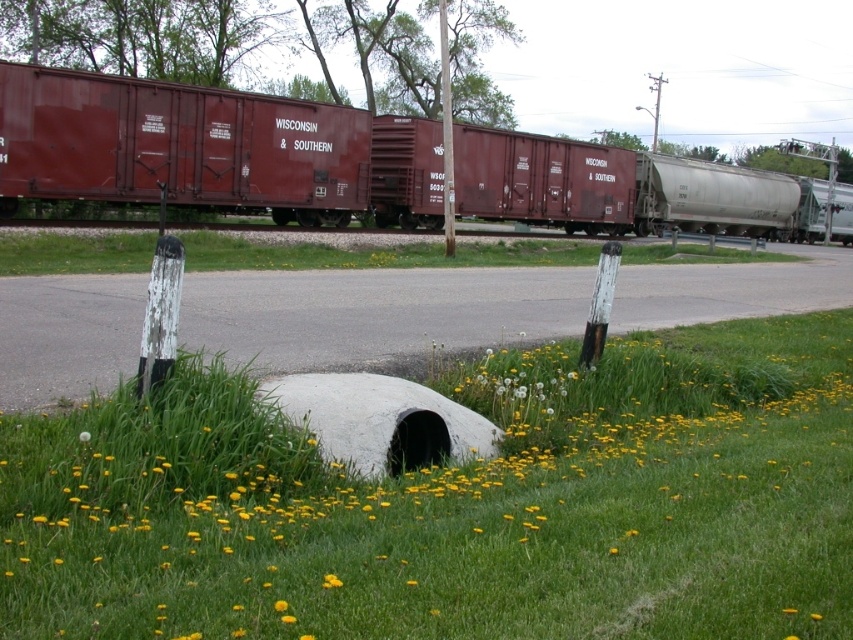
Question: Estimate the real-world distances between objects in this image. Which object is closer to the maroon corrugated metal train car at center?

Choices:
 (A) green grass at lower center
 (B) smooth wooden post at center
 (C) silver metallic tanker at right

Answer: (C)

Question: In this image, where is smooth wooden post at center located relative to yellow matte flower at lower center?

Choices:
 (A) right
 (B) left

Answer: (B)

Question: Is green grass at center smaller than yellow soft dandelion at lower center?

Choices:
 (A) no
 (B) yes

Answer: (A)

Question: Which object is closer to the camera taking this photo?

Choices:
 (A) maroon corrugated metal train car at center
 (B) yellow matte flower at lower center
 (C) green grass at lower center
 (D) silver metallic tanker at right

Answer: (C)

Question: Can you confirm if green grass at lower center is positioned to the right of maroon corrugated metal train car at center?

Choices:
 (A) yes
 (B) no

Answer: (B)

Question: Which is nearer to the yellow soft dandelion at lower center?

Choices:
 (A) smooth wooden post at center
 (B) maroon matte freight car at center

Answer: (A)